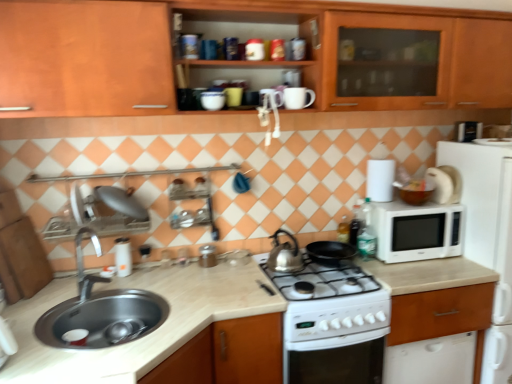
Question: Can you confirm if white matte paper towel at upper right is positioned to the left of satin silver kettle at center?

Choices:
 (A) yes
 (B) no

Answer: (B)

Question: Considering the relative sizes of white matte paper towel at upper right and satin silver kettle at center in the image provided, is white matte paper towel at upper right bigger than satin silver kettle at center?

Choices:
 (A) no
 (B) yes

Answer: (A)

Question: Does white matte paper towel at upper right have a smaller size compared to satin silver kettle at center?

Choices:
 (A) yes
 (B) no

Answer: (A)

Question: Are white matte paper towel at upper right and satin silver kettle at center located far from each other?

Choices:
 (A) yes
 (B) no

Answer: (B)

Question: Can you confirm if white matte paper towel at upper right is thinner than satin silver kettle at center?

Choices:
 (A) no
 (B) yes

Answer: (B)

Question: Would you say satin silver kettle at center is part of white matte paper towel at upper right's contents?

Choices:
 (A) no
 (B) yes

Answer: (A)

Question: Can you confirm if white matte microwave at right is bigger than translucent plastic bottle at stove top, which is counted as the second bottle, starting from the right?

Choices:
 (A) yes
 (B) no

Answer: (A)

Question: Are white matte microwave at right and translucent plastic bottle at stove top, which is counted as the second bottle, starting from the right, beside each other?

Choices:
 (A) no
 (B) yes

Answer: (A)

Question: From the image's perspective, is white matte microwave at right under translucent plastic bottle at stove top, which is counted as the second bottle, starting from the right?

Choices:
 (A) yes
 (B) no

Answer: (A)

Question: From a real-world perspective, does white matte microwave at right sit lower than translucent plastic bottle at stove top, marked as the first bottle in a left-to-right arrangement?

Choices:
 (A) no
 (B) yes

Answer: (B)

Question: Can you confirm if white matte microwave at right is shorter than translucent plastic bottle at stove top, which is counted as the second bottle, starting from the right?

Choices:
 (A) yes
 (B) no

Answer: (B)

Question: Is the depth of white matte microwave at right greater than that of translucent plastic bottle at stove top, which is counted as the second bottle, starting from the right?

Choices:
 (A) no
 (B) yes

Answer: (A)

Question: Can you see wooden cabinet at right, which is the 1th cabinetry from bottom to top, touching metallic silver toaster at upper right, which is the 3th appliance from front to back?

Choices:
 (A) no
 (B) yes

Answer: (A)